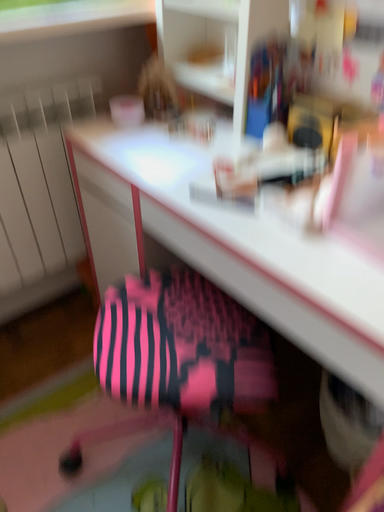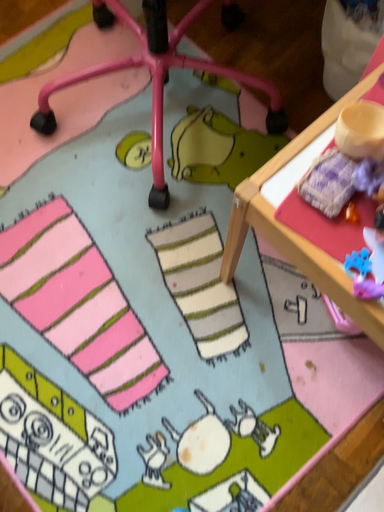
Question: How did the camera likely rotate when shooting the video?

Choices:
 (A) rotated upward
 (B) rotated downward

Answer: (B)